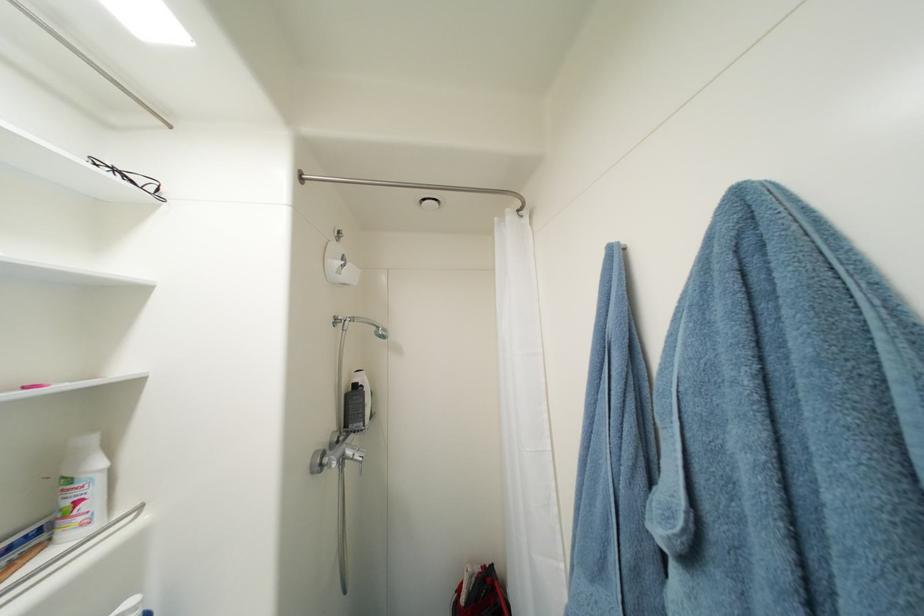
Where is `handheld shower head`? handheld shower head is located at coordinates (344, 440).